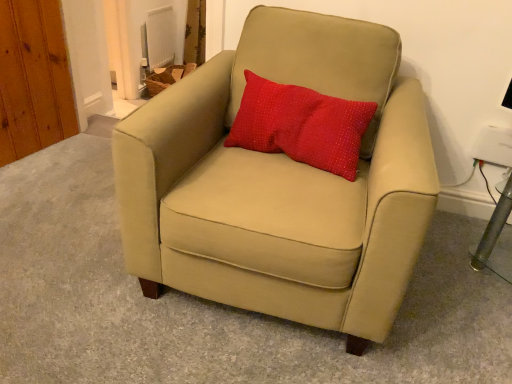
Locate an element on the screen. red dotted fabric pillow at center is located at coordinates point(301,125).

Describe the element at coordinates (301, 125) in the screenshot. The height and width of the screenshot is (384, 512). I see `red dotted fabric pillow at center` at that location.

Where is `suede beige armchair at center`? suede beige armchair at center is located at coordinates (281, 183).

The height and width of the screenshot is (384, 512). Describe the element at coordinates (281, 183) in the screenshot. I see `suede beige armchair at center` at that location.

This screenshot has width=512, height=384. I want to click on red dotted fabric pillow at center, so click(x=301, y=125).

In the image, is suede beige armchair at center on the left side or the right side of red dotted fabric pillow at center?

In the image, suede beige armchair at center appears on the left side of red dotted fabric pillow at center.

Which object is further away from the camera taking this photo, suede beige armchair at center or red dotted fabric pillow at center?

red dotted fabric pillow at center is further from the camera.

Is point (216, 207) in front of point (319, 149)?

That is True.

From the image's perspective, is suede beige armchair at center positioned above or below red dotted fabric pillow at center?

Based on their image positions, suede beige armchair at center is located beneath red dotted fabric pillow at center.

From a real-world perspective, is suede beige armchair at center above or below red dotted fabric pillow at center?

suede beige armchair at center is below red dotted fabric pillow at center.

Which object is thinner, suede beige armchair at center or red dotted fabric pillow at center?

Thinner between the two is red dotted fabric pillow at center.

Is suede beige armchair at center taller than red dotted fabric pillow at center?

Yes, suede beige armchair at center is taller than red dotted fabric pillow at center.

Which of these two, suede beige armchair at center or red dotted fabric pillow at center, is bigger?

With larger size is suede beige armchair at center.

Is suede beige armchair at center not inside red dotted fabric pillow at center?

Indeed, suede beige armchair at center is completely outside red dotted fabric pillow at center.

Is suede beige armchair at center next to red dotted fabric pillow at center and touching it?

There is a gap between suede beige armchair at center and red dotted fabric pillow at center.

Does suede beige armchair at center turn towards red dotted fabric pillow at center?

Result: Yes, suede beige armchair at center is facing red dotted fabric pillow at center.

How many degrees apart are the facing directions of suede beige armchair at center and red dotted fabric pillow at center?

They differ by 2.33 degrees in their facing directions.

How much distance is there between suede beige armchair at center and red dotted fabric pillow at center?

7.93 inches.

Locate an element on the screen. pillow above the suede beige armchair at center (from a real-world perspective) is located at coordinates (301, 125).

Between red dotted fabric pillow at center and suede beige armchair at center, which one appears on the right side from the viewer's perspective?

red dotted fabric pillow at center.

Is red dotted fabric pillow at center further to camera compared to suede beige armchair at center?

Yes, the depth of red dotted fabric pillow at center is greater than that of suede beige armchair at center.

Considering the points (269, 95) and (137, 177), which point is in front, point (269, 95) or point (137, 177)?

Positioned in front is point (137, 177).

Based on the photo, from the image's perspective, who appears lower, red dotted fabric pillow at center or suede beige armchair at center?

suede beige armchair at center, from the image's perspective.

From a real-world perspective, which object rests below the other?

From a 3D spatial view, suede beige armchair at center is below.

Based on the photo, considering the sizes of red dotted fabric pillow at center and suede beige armchair at center in the image, is red dotted fabric pillow at center wider or thinner than suede beige armchair at center?

Considering their sizes, red dotted fabric pillow at center looks slimmer than suede beige armchair at center.

Who is shorter, red dotted fabric pillow at center or suede beige armchair at center?

red dotted fabric pillow at center.

Which of these two, red dotted fabric pillow at center or suede beige armchair at center, is smaller?

red dotted fabric pillow at center is smaller.

Is red dotted fabric pillow at center surrounding suede beige armchair at center?

Actually, suede beige armchair at center is outside red dotted fabric pillow at center.

Is red dotted fabric pillow at center not near suede beige armchair at center?

They are positioned close to each other.

Is red dotted fabric pillow at center positioned with its back to suede beige armchair at center?

Correct, red dotted fabric pillow at center is looking away from suede beige armchair at center.

Image resolution: width=512 pixels, height=384 pixels. What are the coordinates of `pillow behind the suede beige armchair at center` in the screenshot? It's located at (301, 125).

Identify the location of chair in front of the red dotted fabric pillow at center. (281, 183).

Locate an element on the screen. pillow that is above the suede beige armchair at center (from a real-world perspective) is located at coordinates (301, 125).